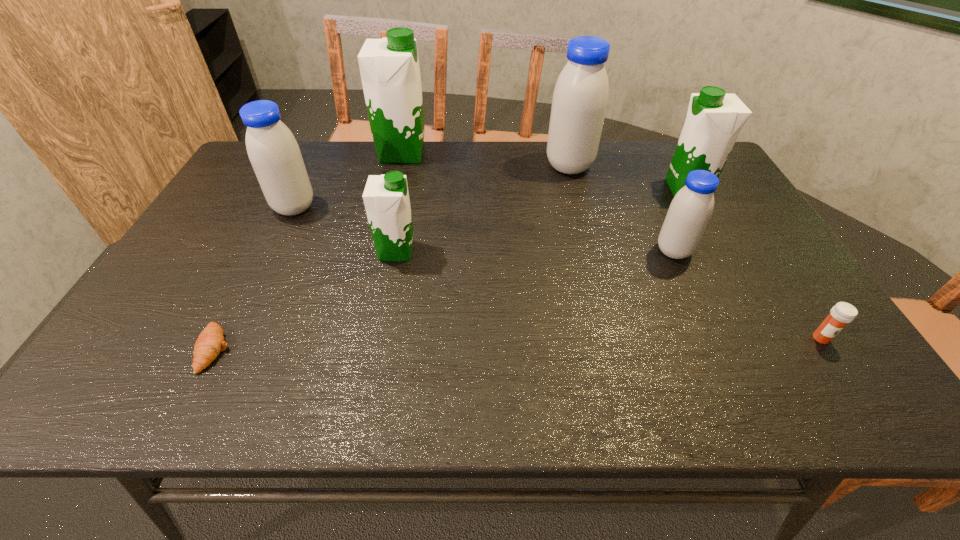
You are a GUI agent. You are given a task and a screenshot of the screen. Output one action in this format:
    pyautogui.click(x=<x>, y=<y>)
    Task: Click on the free space located 0.080m on the right of the nearest blue soya milk
    The image size is (960, 540).
    Given the screenshot: What is the action you would take?
    pyautogui.click(x=723, y=251)

I want to click on vacant space positioned on the label side of the medicine, so click(848, 379).

What are the coordinates of `vacant point located 0.210m on the right of the shortest object` in the screenshot? It's located at (330, 349).

The width and height of the screenshot is (960, 540). In order to click on object that is at the near edge in this screenshot , I will do `click(210, 343)`.

Locate an element on the screen. This screenshot has height=540, width=960. soya milk present at the right edge is located at coordinates (714, 119).

Where is `medicine at the right edge`? Image resolution: width=960 pixels, height=540 pixels. medicine at the right edge is located at coordinates pyautogui.click(x=841, y=314).

Image resolution: width=960 pixels, height=540 pixels. In order to click on object that is at the far right corner in this screenshot , I will do `click(714, 119)`.

This screenshot has width=960, height=540. In the image, there is a desktop. Find the location of `vacant space at the far edge`. vacant space at the far edge is located at coordinates (372, 159).

In the image, there is a desktop. Identify the location of vacant space at the near edge. (186, 384).

You are a GUI agent. You are given a task and a screenshot of the screen. Output one action in this format:
    pyautogui.click(x=<x>, y=<y>)
    Task: Click on the vacant space at the left edge of the desktop
    This screenshot has height=540, width=960.
    Given the screenshot: What is the action you would take?
    pyautogui.click(x=231, y=184)